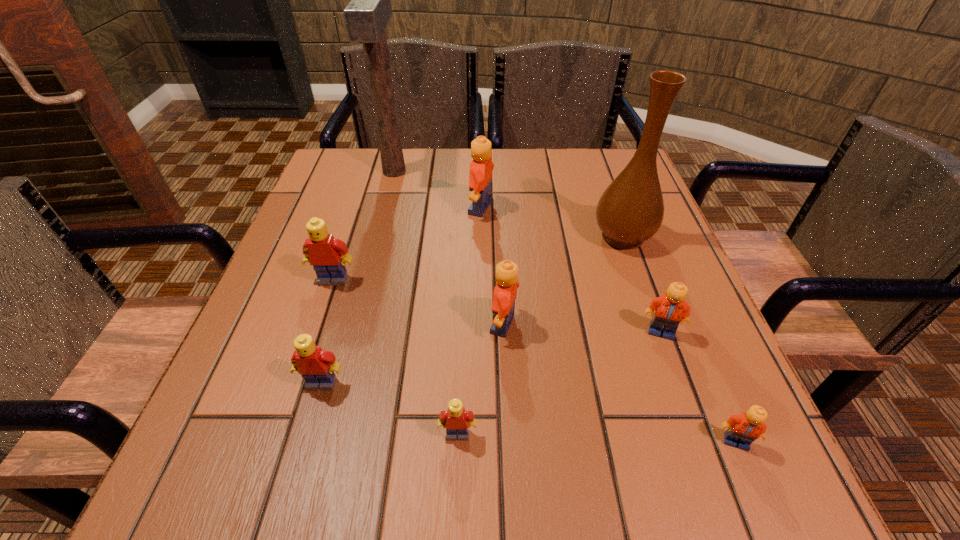
This screenshot has height=540, width=960. In order to click on the farthest object in this screenshot , I will do `click(366, 16)`.

Where is `brown vase`? The height and width of the screenshot is (540, 960). brown vase is located at coordinates (630, 211).

The width and height of the screenshot is (960, 540). Identify the location of vase. (630, 211).

Where is `the farthest orange Lego`? the farthest orange Lego is located at coordinates (480, 176).

Locate an element on the screen. This screenshot has height=540, width=960. the farthest Lego is located at coordinates (480, 176).

At what (x,y) coordinates should I click in order to perform the action: click on the second biggest orange Lego. Please return your answer as a coordinate pair (x, y). The height and width of the screenshot is (540, 960). Looking at the image, I should click on (505, 292).

At what (x,y) coordinates should I click in order to perform the action: click on the sixth nearest object. Please return your answer as a coordinate pair (x, y). The image size is (960, 540). Looking at the image, I should click on (323, 252).

Identify the location of the sixth nearest Lego. (323, 252).

Image resolution: width=960 pixels, height=540 pixels. What are the coordinates of `the third biggest orange Lego` in the screenshot? It's located at (670, 309).

Identify the location of the second farthest yellow Lego. The height and width of the screenshot is (540, 960). (316, 366).